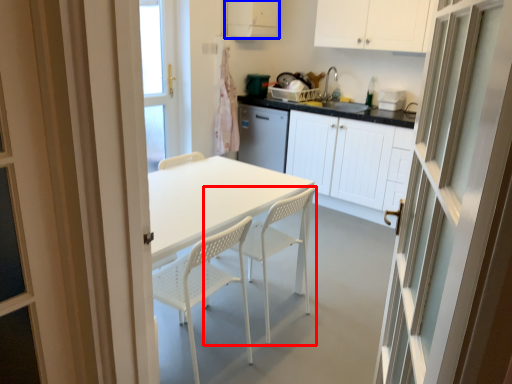
Question: Among these objects, which one is farthest to the camera, chair (highlighted by a red box) or cabinetry (highlighted by a blue box)?

Choices:
 (A) chair
 (B) cabinetry

Answer: (B)